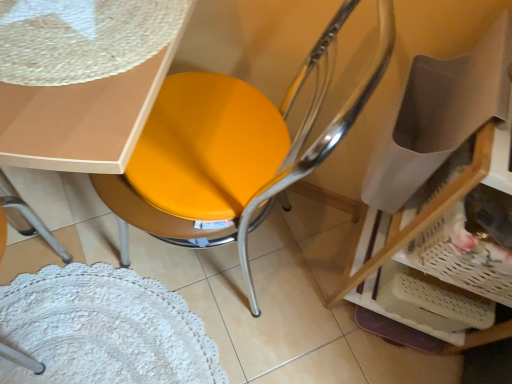
This screenshot has width=512, height=384. In order to click on free space in front of matte yellow seat at center in this screenshot , I will do `click(187, 347)`.